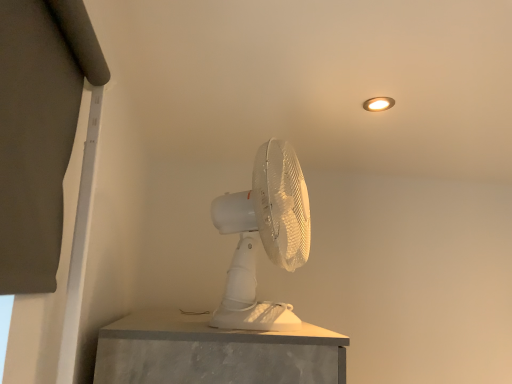
Question: Could you tell me if matte white light fixture at upper right is turned towards white plastic mechanical fan at center?

Choices:
 (A) no
 (B) yes

Answer: (A)

Question: Can you confirm if matte white light fixture at upper right is taller than white plastic mechanical fan at center?

Choices:
 (A) yes
 (B) no

Answer: (B)

Question: From a real-world perspective, is matte white light fixture at upper right physically above white plastic mechanical fan at center?

Choices:
 (A) no
 (B) yes

Answer: (B)

Question: From the image's perspective, is matte white light fixture at upper right above white plastic mechanical fan at center?

Choices:
 (A) no
 (B) yes

Answer: (B)

Question: Can you confirm if matte white light fixture at upper right is wider than white plastic mechanical fan at center?

Choices:
 (A) yes
 (B) no

Answer: (B)

Question: Is matte white light fixture at upper right outside white plastic mechanical fan at center?

Choices:
 (A) no
 (B) yes

Answer: (B)

Question: Does white plastic mechanical fan at center appear on the left side of matte white light fixture at upper right?

Choices:
 (A) no
 (B) yes

Answer: (B)

Question: Is white plastic mechanical fan at center directly adjacent to matte white light fixture at upper right?

Choices:
 (A) yes
 (B) no

Answer: (B)

Question: Is white plastic mechanical fan at center outside matte white light fixture at upper right?

Choices:
 (A) yes
 (B) no

Answer: (A)

Question: From a real-world perspective, is white plastic mechanical fan at center positioned under matte white light fixture at upper right based on gravity?

Choices:
 (A) no
 (B) yes

Answer: (B)

Question: Is white plastic mechanical fan at center further to camera compared to matte white light fixture at upper right?

Choices:
 (A) yes
 (B) no

Answer: (B)

Question: Does white plastic mechanical fan at center have a lesser width compared to matte white light fixture at upper right?

Choices:
 (A) yes
 (B) no

Answer: (B)

Question: Is matte white light fixture at upper right inside or outside of white plastic mechanical fan at center?

Choices:
 (A) outside
 (B) inside

Answer: (A)